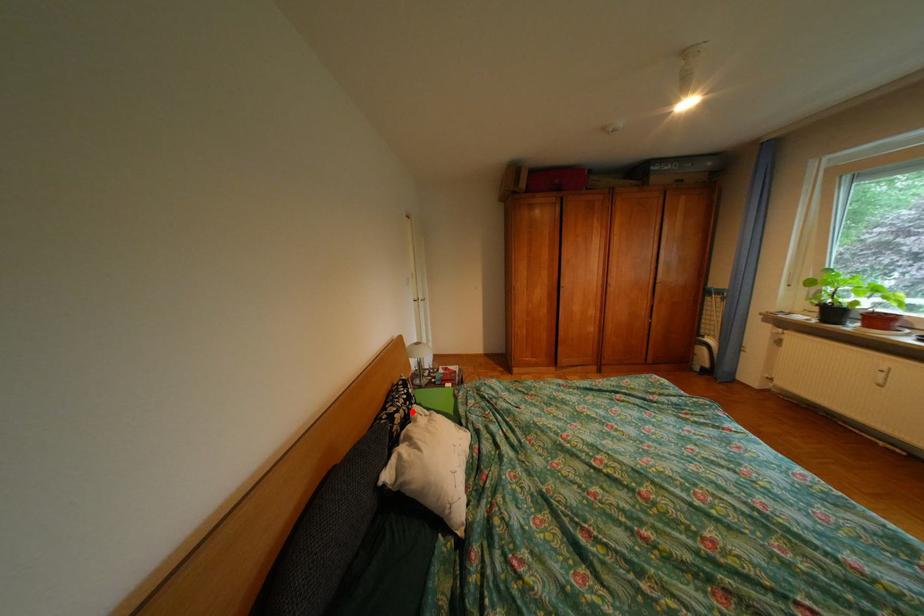
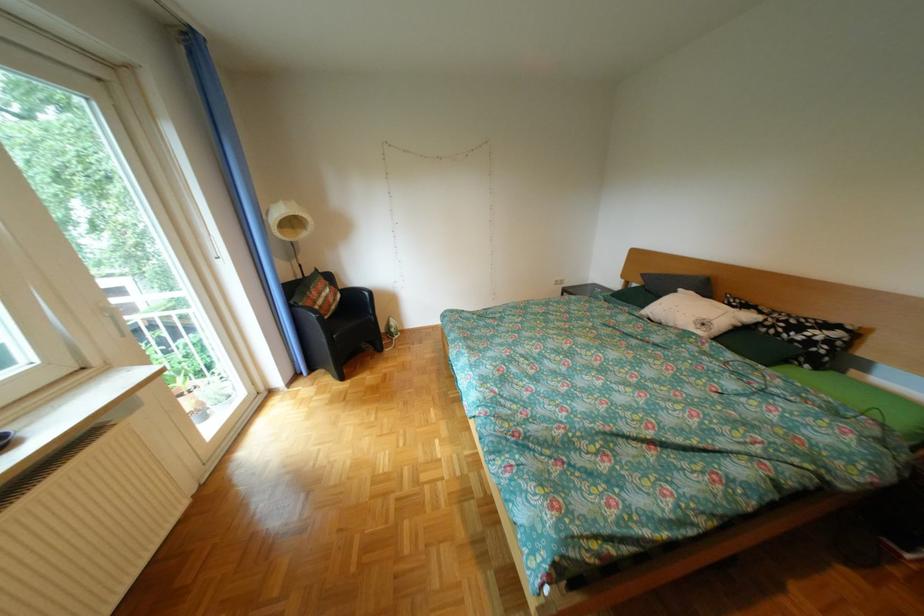
Question: I am providing you with two images of the same scene from different viewpoints. Image1 has a red point marked. In image2, the corresponding 3D location appears at what relative position? Reply with the corresponding letter.

Choices:
 (A) Closer
 (B) Farther

Answer: (B)